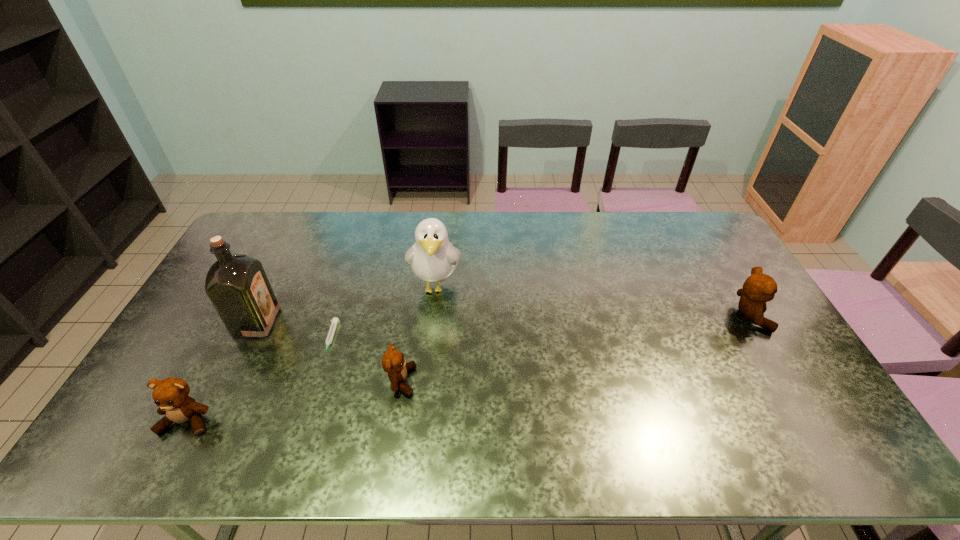
To achieve even spacing by inserting another teddy_bear among them, please point to a vacant spot for this new teddy_bear. Please provide its 2D coordinates. Your answer should be formatted as a tuple, i.e. [(x, y)], where the tuple contains the x and y coordinates of a point satisfying the conditions above.

[(587, 346)]